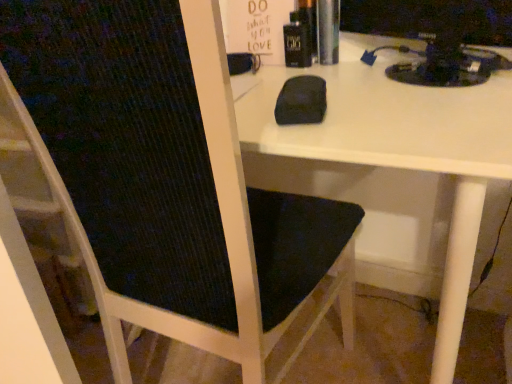
Question: Is black fabric chair at center smaller than black plastic monitor at upper right?

Choices:
 (A) no
 (B) yes

Answer: (A)

Question: Is black fabric chair at center taller than black plastic monitor at upper right?

Choices:
 (A) yes
 (B) no

Answer: (A)

Question: From the image's perspective, is black fabric chair at center located above black plastic monitor at upper right?

Choices:
 (A) yes
 (B) no

Answer: (B)

Question: Is black fabric chair at center positioned far away from black plastic monitor at upper right?

Choices:
 (A) yes
 (B) no

Answer: (B)

Question: Is black fabric chair at center positioned before black plastic monitor at upper right?

Choices:
 (A) no
 (B) yes

Answer: (B)

Question: From a real-world perspective, is black fabric chair at center over black plastic monitor at upper right?

Choices:
 (A) yes
 (B) no

Answer: (B)

Question: Is black plastic monitor at upper right positioned with its back to black fabric chair at center?

Choices:
 (A) no
 (B) yes

Answer: (A)

Question: Is black plastic monitor at upper right at the right side of black fabric chair at center?

Choices:
 (A) yes
 (B) no

Answer: (A)

Question: Does black plastic monitor at upper right appear on the left side of black fabric chair at center?

Choices:
 (A) yes
 (B) no

Answer: (B)

Question: Would you say black plastic monitor at upper right is a long distance from black fabric chair at center?

Choices:
 (A) yes
 (B) no

Answer: (B)

Question: Is black plastic monitor at upper right located outside black fabric chair at center?

Choices:
 (A) yes
 (B) no

Answer: (A)

Question: Could you tell me if black plastic monitor at upper right is facing black fabric chair at center?

Choices:
 (A) yes
 (B) no

Answer: (B)

Question: Is black plastic monitor at upper right to the left or to the right of black fabric chair at center in the image?

Choices:
 (A) right
 (B) left

Answer: (A)